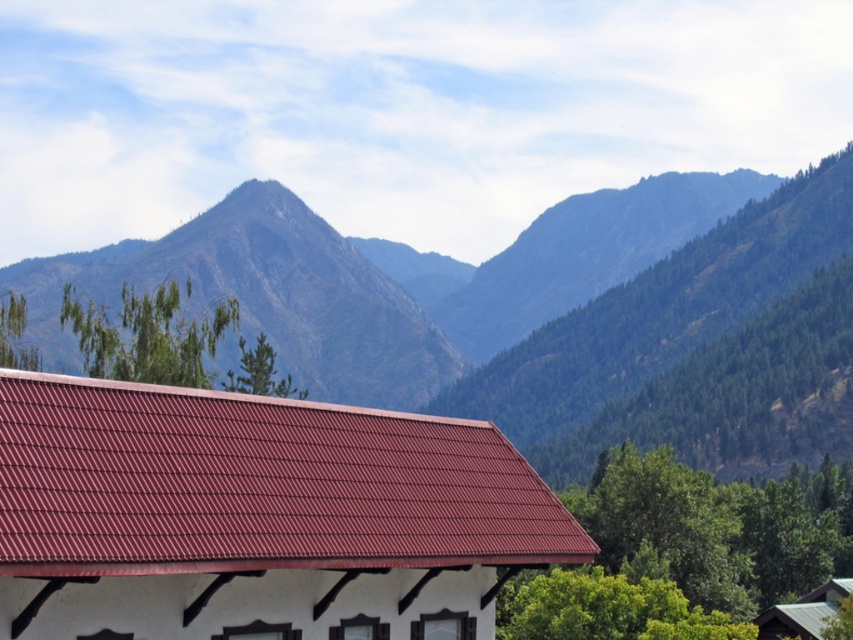
What do you see at coordinates (695, 348) in the screenshot?
I see `green textured mountain at upper center` at bounding box center [695, 348].

Is green textured mountain at upper center to the left of rugged granite peak at upper center from the viewer's perspective?

Incorrect, green textured mountain at upper center is not on the left side of rugged granite peak at upper center.

You are a GUI agent. You are given a task and a screenshot of the screen. Output one action in this format:
    pyautogui.click(x=<x>, y=<y>)
    Task: Click on the green textured mountain at upper center
    Image resolution: width=853 pixels, height=640 pixels.
    Given the screenshot: What is the action you would take?
    pyautogui.click(x=695, y=348)

Who is lower down, metallic red roof at center or metallic gray hut at lower right?

Positioned lower is metallic gray hut at lower right.

Between metallic red roof at center and metallic gray hut at lower right, which one appears on the right side from the viewer's perspective?

Positioned to the right is metallic gray hut at lower right.

What do you see at coordinates (253, 513) in the screenshot? The width and height of the screenshot is (853, 640). I see `metallic red roof at center` at bounding box center [253, 513].

Locate an element on the screen. Image resolution: width=853 pixels, height=640 pixels. metallic red roof at center is located at coordinates (253, 513).

Can you confirm if rugged granite peak at upper center is smaller than metallic gray hut at lower right?

Actually, rugged granite peak at upper center might be larger than metallic gray hut at lower right.

Is point (291, 259) in front of point (796, 618)?

No, (291, 259) is behind (796, 618).

This screenshot has width=853, height=640. I want to click on rugged granite peak at upper center, so click(x=265, y=298).